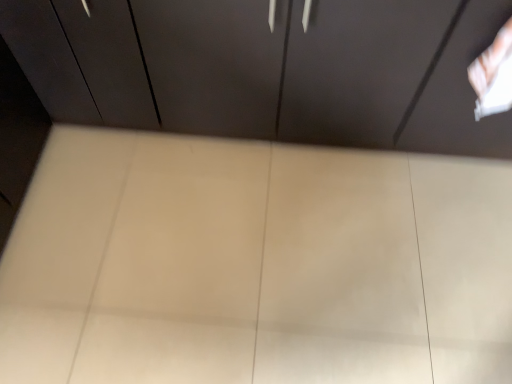
Question: In the image, is matte dark wood cupboard at center on the left side or the right side of white glossy plywood at center?

Choices:
 (A) left
 (B) right

Answer: (B)

Question: Considering the positions of matte dark wood cupboard at center and white glossy plywood at center in the image, is matte dark wood cupboard at center bigger or smaller than white glossy plywood at center?

Choices:
 (A) small
 (B) big

Answer: (B)

Question: Is matte dark wood cupboard at center situated inside white glossy plywood at center or outside?

Choices:
 (A) inside
 (B) outside

Answer: (B)

Question: Is point (162, 357) closer or farther from the camera than point (353, 87)?

Choices:
 (A) farther
 (B) closer

Answer: (B)

Question: Considering the positions of white glossy plywood at center and matte dark wood cupboard at center in the image, is white glossy plywood at center taller or shorter than matte dark wood cupboard at center?

Choices:
 (A) tall
 (B) short

Answer: (B)

Question: In terms of width, does white glossy plywood at center look wider or thinner when compared to matte dark wood cupboard at center?

Choices:
 (A) wide
 (B) thin

Answer: (A)

Question: Based on their sizes in the image, would you say white glossy plywood at center is bigger or smaller than matte dark wood cupboard at center?

Choices:
 (A) big
 (B) small

Answer: (B)